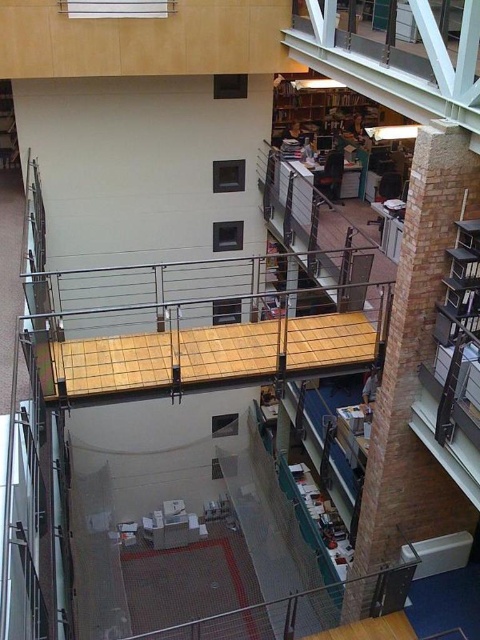
Is brick wall at right closer to the viewer compared to wooden bookshelf at upper left?

Yes, brick wall at right is closer to the viewer.

Which is in front, point (396, 540) or point (12, 115)?

Positioned in front is point (396, 540).

Who is more forward, (x=464, y=157) or (x=7, y=99)?

Positioned in front is point (x=464, y=157).

I want to click on brick wall at right, so click(411, 380).

Can you confirm if wooden bookshelf at upper center is positioned to the right of wooden bookshelf at upper left?

Yes, wooden bookshelf at upper center is to the right of wooden bookshelf at upper left.

Can you confirm if wooden bookshelf at upper center is thinner than wooden bookshelf at upper left?

In fact, wooden bookshelf at upper center might be wider than wooden bookshelf at upper left.

Between point (280, 118) and point (15, 138), which one is positioned behind?

The point (280, 118) is behind.

Locate an element on the screen. wooden bookshelf at upper center is located at coordinates (320, 108).

Does brick wall at right have a lesser width compared to wooden bookshelf at upper center?

Yes.

Between brick wall at right and wooden bookshelf at upper center, which one appears on the right side from the viewer's perspective?

Positioned to the right is wooden bookshelf at upper center.

Find the location of a particular element. The width and height of the screenshot is (480, 640). brick wall at right is located at coordinates (411, 380).

I want to click on brick wall at right, so click(x=411, y=380).